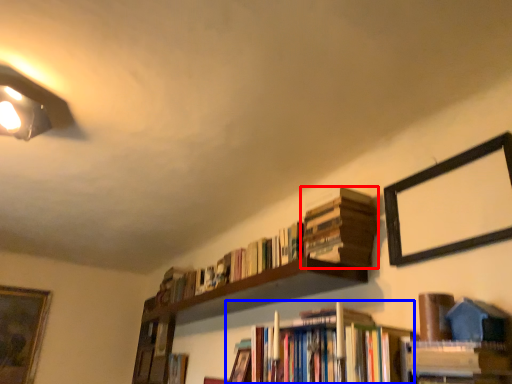
Question: Which of the following is the farthest to the observer, book (highlighted by a red box) or book (highlighted by a blue box)?

Choices:
 (A) book
 (B) book

Answer: (A)